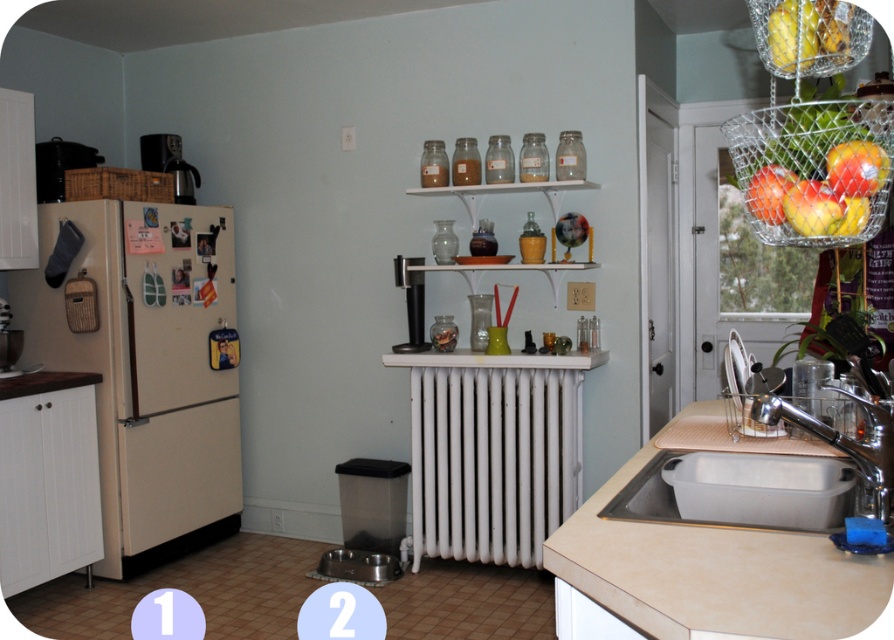
Question: Can you confirm if stainless steel sink at lower right is positioned below chrome metallic faucet at sink right?

Choices:
 (A) no
 (B) yes

Answer: (B)

Question: Which point is closer to the camera?

Choices:
 (A) (40, 378)
 (B) (192, 182)

Answer: (A)

Question: Can you confirm if beige matte refrigerator at left is positioned to the left of matte black coffee maker at upper left?

Choices:
 (A) no
 (B) yes

Answer: (B)

Question: Estimate the real-world distances between objects in this image. Which object is farther from the matte black coffee maker at upper left?

Choices:
 (A) black plastic coffee maker at center
 (B) yellow matte apple at upper right
 (C) chrome metallic faucet at sink right
 (D) wooden countertop at lower left

Answer: (C)

Question: Which object appears closest to the camera in this image?

Choices:
 (A) white painted metal radiator at center
 (B) wooden countertop at lower left
 (C) yellow matte apple at upper right

Answer: (C)

Question: Is stainless steel sink at lower right further to the viewer compared to chrome metallic faucet at sink right?

Choices:
 (A) no
 (B) yes

Answer: (A)